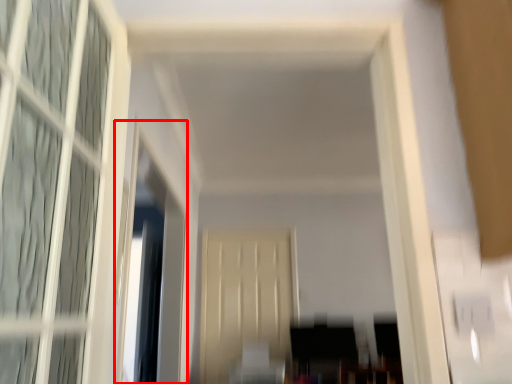
Question: Where is window screen (annotated by the red box) located in relation to screen door in the image?

Choices:
 (A) right
 (B) left

Answer: (B)